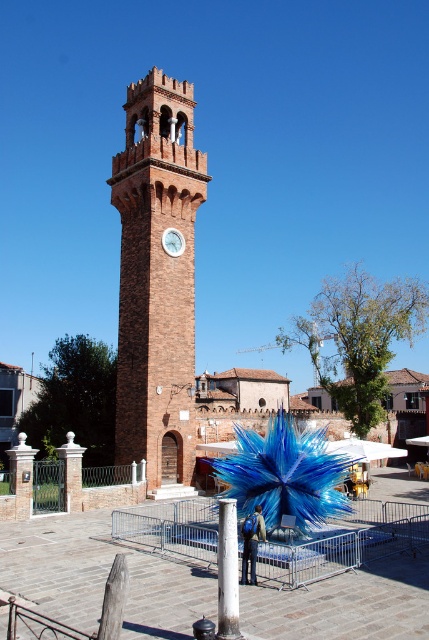
Please provide the 2D coordinates of the brick clock tower at center in the image.

The brick clock tower at center is located at coordinates [157,280].

You are standing in front of the brick clock tower at center and want to take a photo of the white glossy clock at center. Which object is closer to your camera lens?

The brick clock tower at center is closer to the viewer than the white glossy clock at center, so the brick clock tower at center will appear closer to your camera lens.

You are standing at the base of the clock tower and want to take a photo of the blue glass sculpture. To do this, you need to walk around the white painted metal pole at center. Which direction should you move relative to the pole to get a clear view?

You should move to the left or right of the white painted metal pole at center to get a clear view of the blue glass sculpture, as the pole is positioned directly in front of the sculpture.